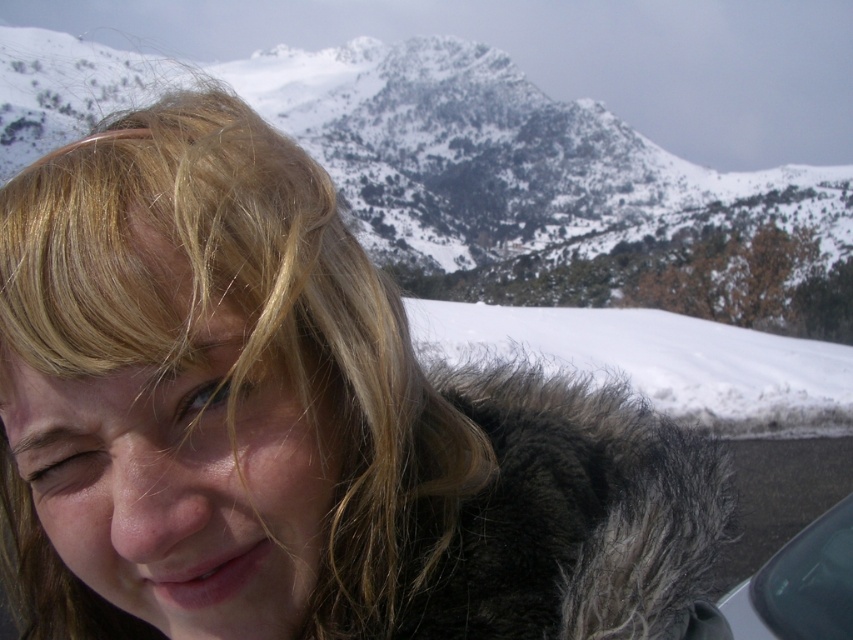
Is point (579, 317) behind point (792, 600)?

Yes, point (579, 317) is farther from viewer.

Which of these two, white fluffy snow at lower right or transparent glass car window at lower right, stands shorter?

transparent glass car window at lower right is shorter.

Measure the distance between point (694,365) and camera.

246.41 feet

The image size is (853, 640). I want to click on white fluffy snow at lower right, so click(x=660, y=362).

Can you confirm if snowy rocky mountain at upper center is positioned above white fluffy snow at lower right?

Yes.

Can you confirm if snowy rocky mountain at upper center is bigger than white fluffy snow at lower right?

Yes, snowy rocky mountain at upper center is bigger than white fluffy snow at lower right.

Does point (560, 296) come behind point (753, 333)?

Yes, it is.

Where is `snowy rocky mountain at upper center`? snowy rocky mountain at upper center is located at coordinates (548, 189).

Which is above, snowy rocky mountain at upper center or transparent glass car window at lower right?

snowy rocky mountain at upper center is above.

Does snowy rocky mountain at upper center appear under transparent glass car window at lower right?

Incorrect, snowy rocky mountain at upper center is not positioned below transparent glass car window at lower right.

Measure the distance between snowy rocky mountain at upper center and camera.

snowy rocky mountain at upper center and camera are 103.14 meters apart from each other.

At what (x,y) coordinates should I click in order to perform the action: click on snowy rocky mountain at upper center. Please return your answer as a coordinate pair (x, y). This screenshot has height=640, width=853. Looking at the image, I should click on (548, 189).